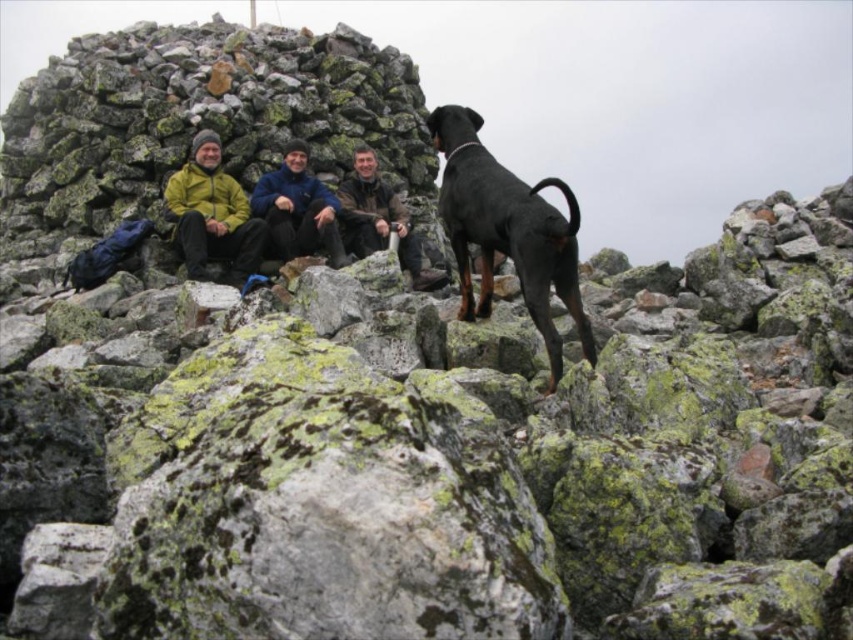
You are a hiker planning to place a 3 meter long tent between the black smooth doberman at center and the matte yellow jacket at center. Can the tent fit in the space between them?

The black smooth doberman at center is 3.16 meters from the matte yellow jacket at center, so yes, the tent can fit since the distance is slightly longer than the tent.

Looking at this image, you are a hiker trying to identify clothing items in the scene. Which clothing item is closer to you between the matte yellow jacket at center and the blue fleece jacket at center?

The matte yellow jacket at center is closer to you since it is positioned in front of the blue fleece jacket at center.